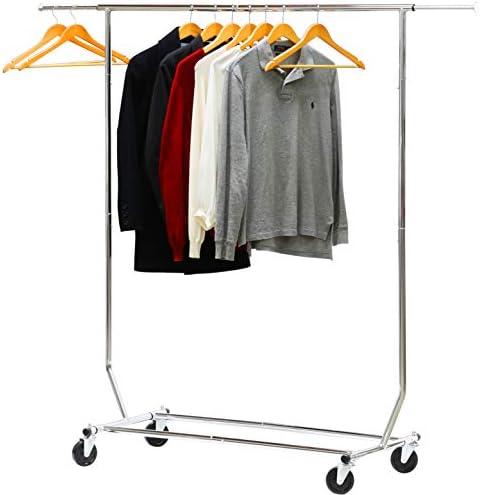
The width and height of the screenshot is (480, 495). I want to click on clothes hangers, so click(52, 32), click(71, 32), click(179, 34), click(209, 34), click(222, 32), click(245, 32), click(257, 30), click(279, 30), click(317, 27).